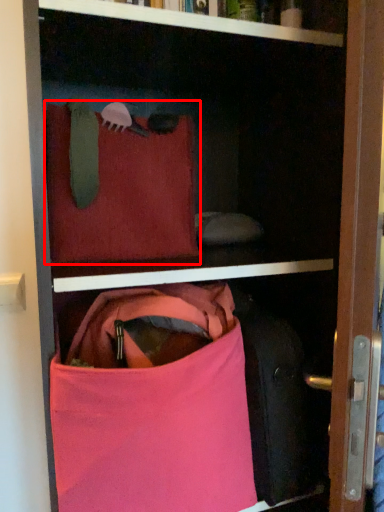
Question: From the image's perspective, where is pillow (annotated by the red box) located in relation to handbag in the image?

Choices:
 (A) above
 (B) below

Answer: (A)